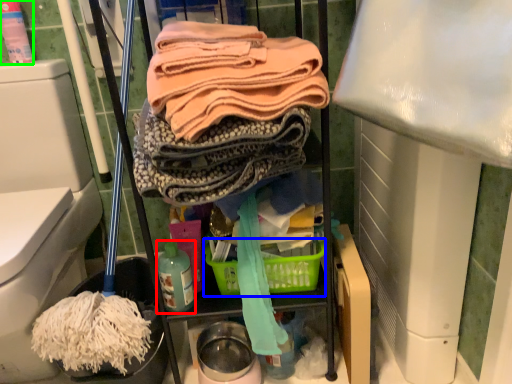
Question: Based on their relative distances, which object is farther from bottle (highlighted by a red box)? Choose from basket (highlighted by a blue box) and cleaning product (highlighted by a green box).

Choices:
 (A) basket
 (B) cleaning product

Answer: (B)